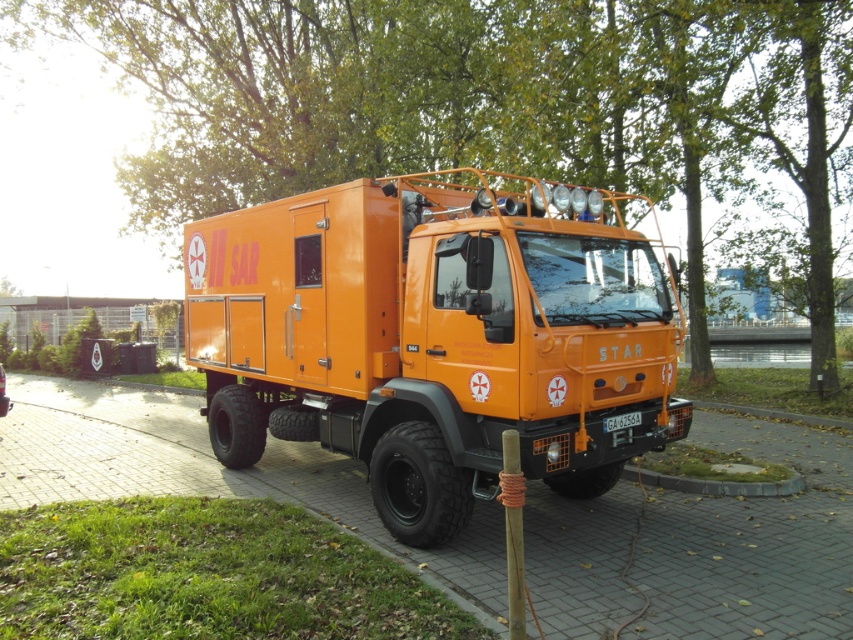
Question: Which point is farther from the camera taking this photo?

Choices:
 (A) (474, 515)
 (B) (619, 422)
 (C) (512, 568)

Answer: (A)

Question: Estimate the real-world distances between objects in this image. Which object is closer to the green leafy tree at upper center?

Choices:
 (A) brown wood pole at center
 (B) orange matte truck at center
 (C) orange rubber pavement at center

Answer: (C)

Question: Which of these objects is positioned farthest from the brown wood pole at center?

Choices:
 (A) orange rubber pavement at center
 (B) green leafy tree at upper center
 (C) orange matte truck at center

Answer: (B)

Question: Is orange matte truck at center further to camera compared to black plastic license plate at center?

Choices:
 (A) no
 (B) yes

Answer: (A)

Question: Does orange matte truck at center appear on the right side of orange rubber pavement at center?

Choices:
 (A) yes
 (B) no

Answer: (A)

Question: Is orange matte truck at center to the left of orange rubber pavement at center from the viewer's perspective?

Choices:
 (A) no
 (B) yes

Answer: (A)